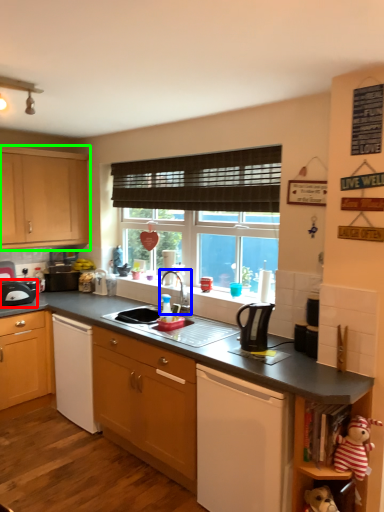
Question: Which object is the farthest from kitchen appliance (highlighted by a red box)? Choose among these: tap (highlighted by a blue box) or cabinetry (highlighted by a green box).

Choices:
 (A) tap
 (B) cabinetry

Answer: (A)